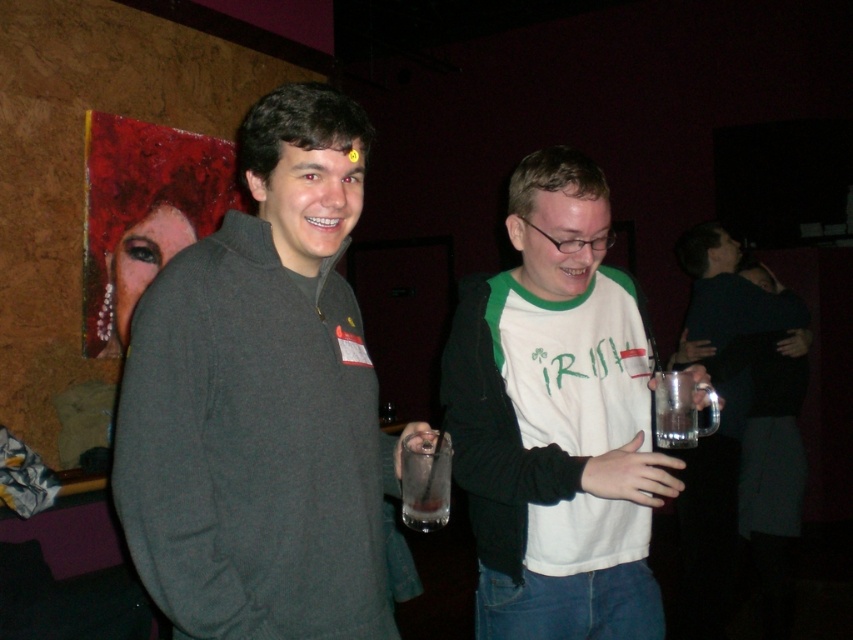
Consider the image. Between white matte t-shirt at center and clear glass at right, which one has more height?

Standing taller between the two is white matte t-shirt at center.

Can you confirm if white matte t-shirt at center is shorter than clear glass at right?

No.

Which is behind, point (584, 339) or point (683, 384)?

The point (584, 339) is more distant.

Identify the location of white matte t-shirt at center. This screenshot has height=640, width=853. (556, 419).

Is dark gray sweater at center below clear glass at center?

No.

Locate an element on the screen. This screenshot has height=640, width=853. dark gray sweater at center is located at coordinates (263, 403).

This screenshot has height=640, width=853. In order to click on dark gray sweater at center in this screenshot , I will do coord(263,403).

Who is more forward, (683, 564) or (418, 474)?

Point (418, 474)

Where is `clear glass mug at right`? The image size is (853, 640). clear glass mug at right is located at coordinates (730, 300).